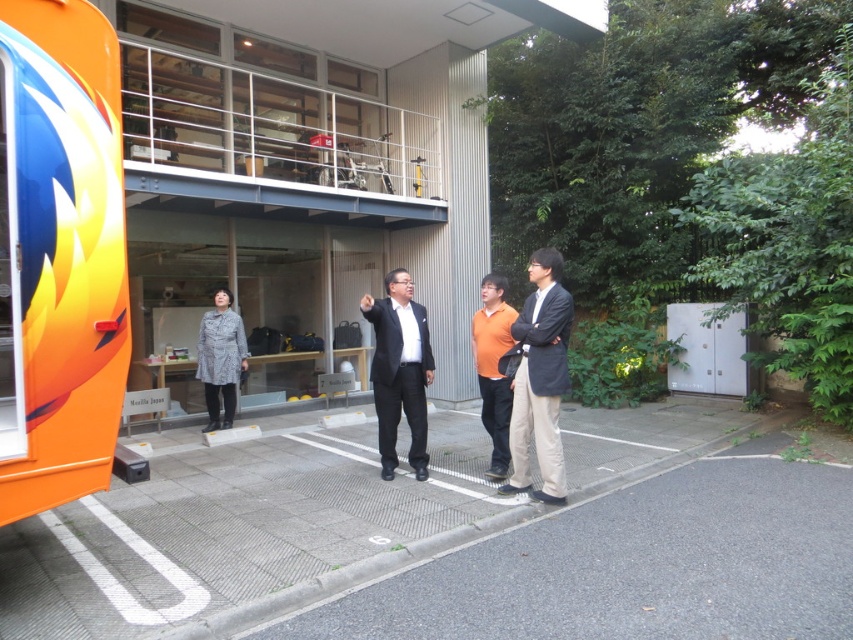
You are standing in the outdoor scene and want to walk from point A to point B. Point A is at coordinates point (532, 260) and point B is at coordinates point (508, 422). Which point is closer to you when you start walking?

Point (532, 260) is closer to the viewer than point (508, 422), so you will start at the closer point A and walk towards point B.

You are standing in front of the building and want to take a photo of both point [105,465] and point [392,292]. Which point should you focus on first to ensure both are in focus?

You should focus on point [105,465] first because it is closer to the camera, ensuring the depth of field will cover both points.